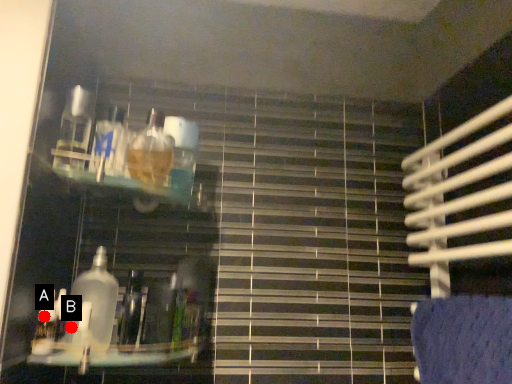
Question: Two points are circled on the image, labeled by A and B beside each circle. Which of the following is the farthest from the observer?

Choices:
 (A) A is further
 (B) B is further

Answer: (B)